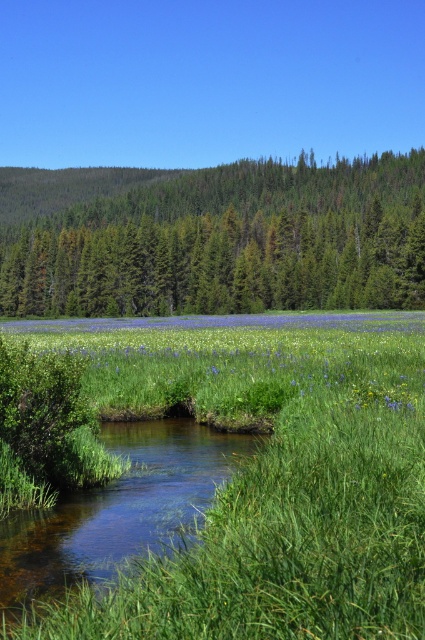
Is point (399, 275) closer to viewer compared to point (48, 513)?

That is False.

Is green textured trees at upper center taller than clear water stream at center?

Yes.

Which is behind, point (365, 230) or point (218, 476)?

Point (365, 230)

Locate an element on the screen. green textured trees at upper center is located at coordinates (214, 237).

Which of these two, green textured trees at upper center or blue matte flower at center, stands shorter?

blue matte flower at center is shorter.

The width and height of the screenshot is (425, 640). I want to click on green textured trees at upper center, so (214, 237).

At what (x,y) coordinates should I click in order to perform the action: click on green textured trees at upper center. Please return your answer as a coordinate pair (x, y). This screenshot has height=640, width=425. Looking at the image, I should click on (214, 237).

Can you confirm if green grassy at center is smaller than clear water stream at center?

Incorrect, green grassy at center is not smaller in size than clear water stream at center.

Does green grassy at center have a larger size compared to clear water stream at center?

Yes, green grassy at center is bigger than clear water stream at center.

This screenshot has width=425, height=640. What do you see at coordinates (238, 483) in the screenshot?
I see `green grassy at center` at bounding box center [238, 483].

You are a GUI agent. You are given a task and a screenshot of the screen. Output one action in this format:
    pyautogui.click(x=<x>, y=<y>)
    Task: Click on the green grassy at center
    
    Given the screenshot: What is the action you would take?
    pyautogui.click(x=238, y=483)